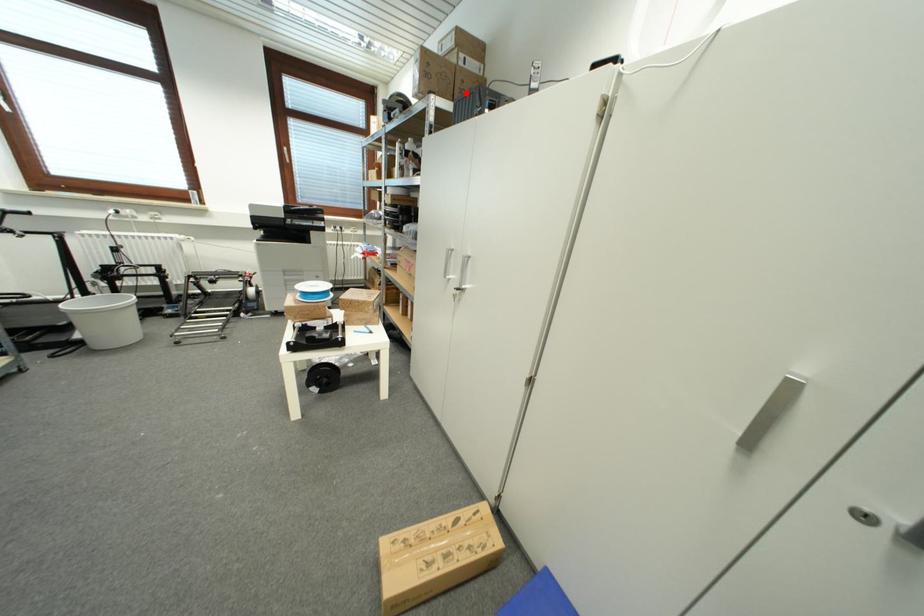
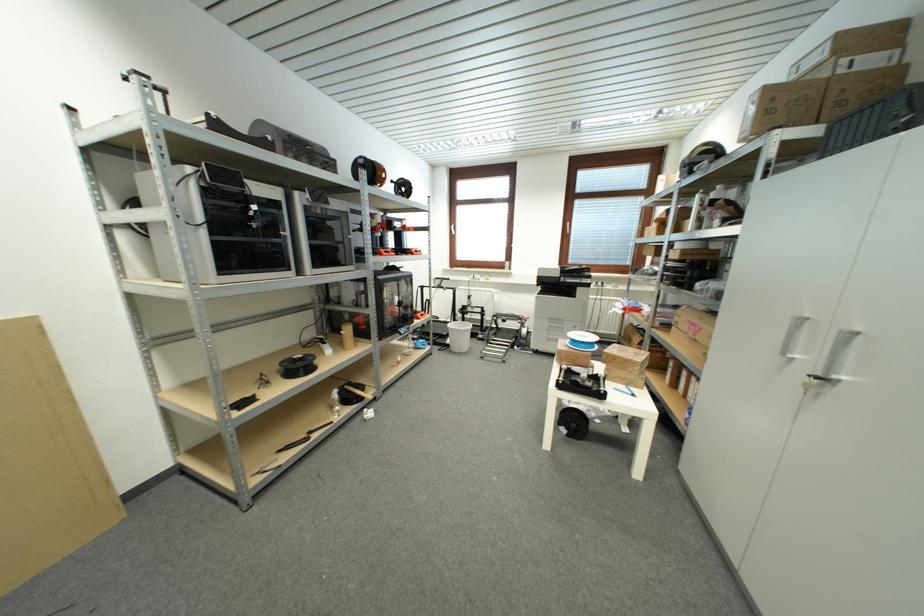
Question: A red point is marked in image1. In image2, is the corresponding 3D point closer to the camera or farther? Reply with the corresponding letter.

Choices:
 (A) The corresponding 3D point is closer.
 (B) The corresponding 3D point is farther.

Answer: (B)